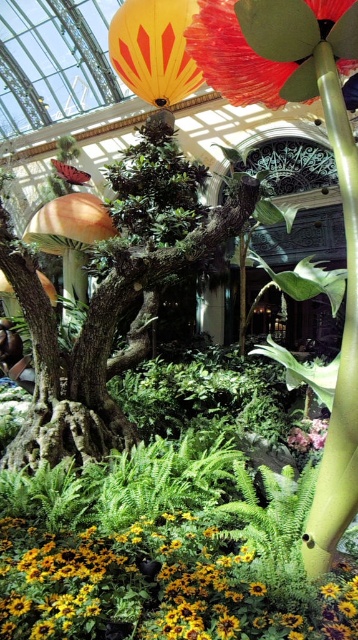
You are standing in the vibrant indoor garden and want to place a small statue between the two points marked as point (x=50, y=458) and point (x=185, y=556). Since you want the statue to be closer to you, which point should you position it near?

To position the statue closer to you, place it near point (x=50, y=458) because it is further to the camera than point (x=185, y=556).

You are a gardener planning to install a new sprinkler system in the conservatory. The sprinkler must be placed equidistant from the green rough bark tree at center and the large artificial mushroom with bright orange cap and green stem. Given the coordinates from the scene description, where should the sprinkler be positioned?

The green rough bark tree at center is located at point (117, 294). To place the sprinkler equidistant from both objects, calculate the midpoint between their coordinates. However, the coordinates for the artificial mushroom are not provided in the Objects Description. Without this information, the exact position cannot be determined.